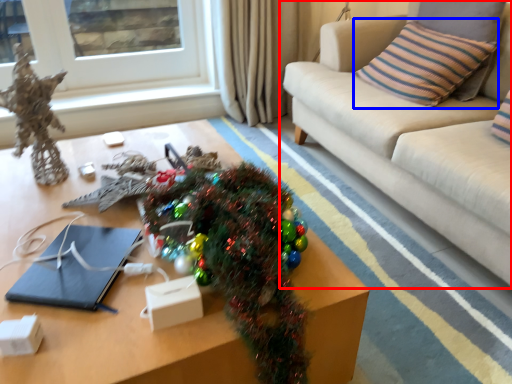
Question: Which of the following is the farthest to the observer, studio couch (highlighted by a red box) or pillow (highlighted by a blue box)?

Choices:
 (A) studio couch
 (B) pillow

Answer: (B)